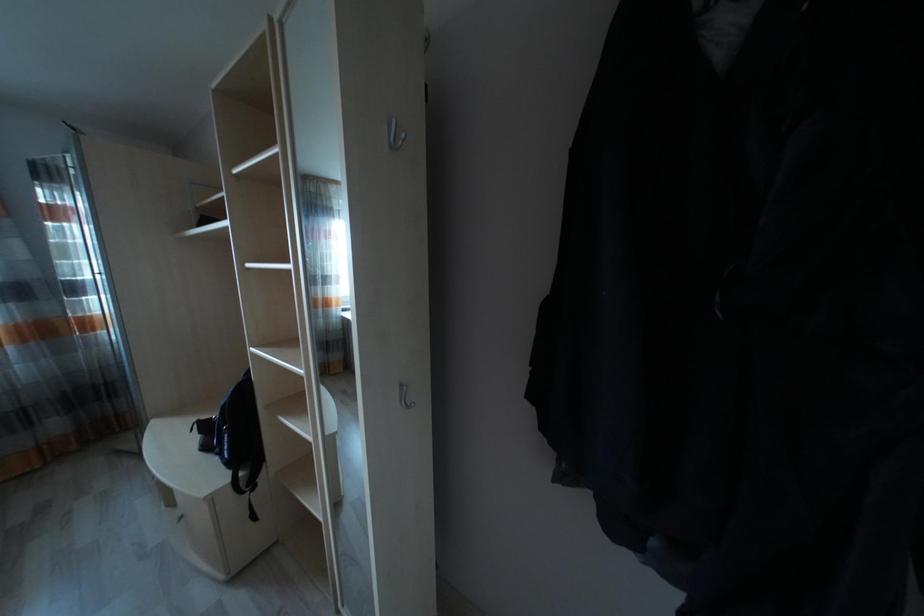
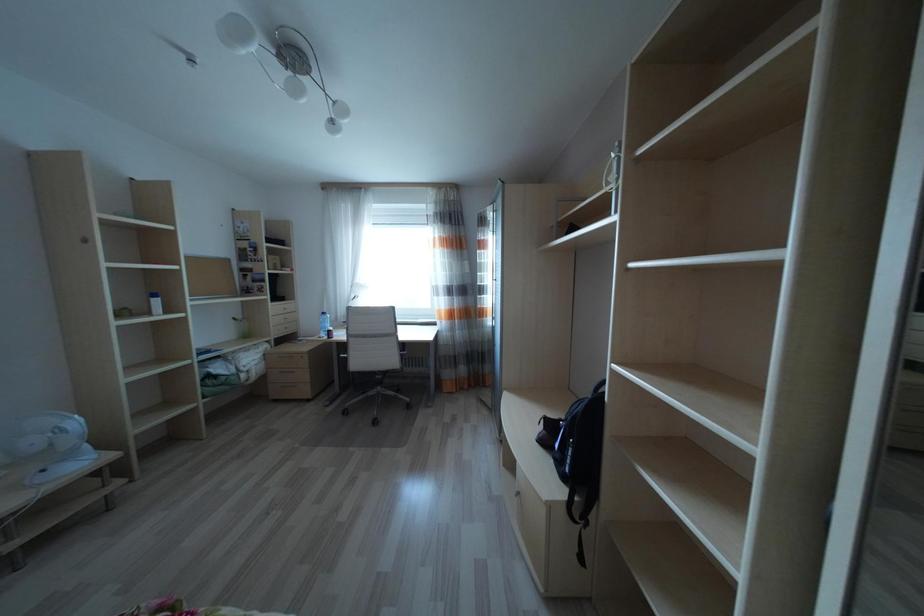
Question: The images are taken continuously from a first-person perspective. In which direction is your viewpoint rotating?

Choices:
 (A) Left
 (B) Right
 (C) Up
 (D) Down

Answer: (A)